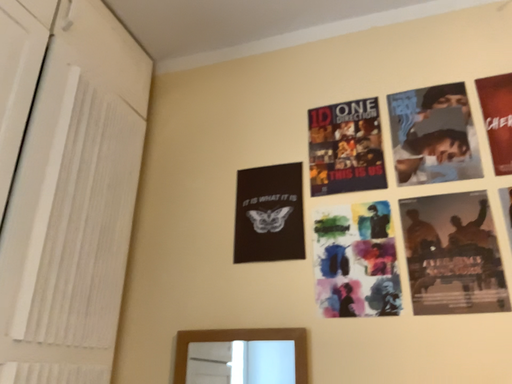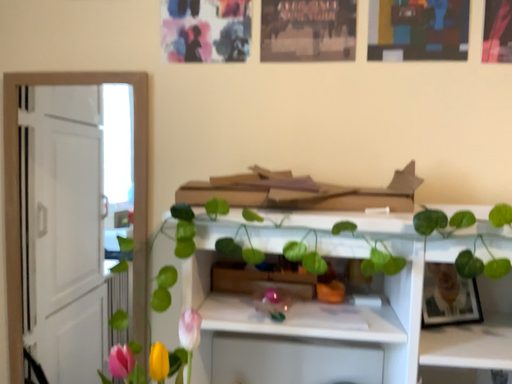
Question: Which way did the camera rotate in the video?

Choices:
 (A) rotated upward
 (B) rotated downward

Answer: (B)